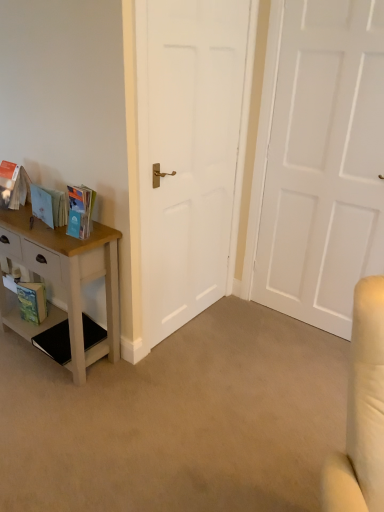
The height and width of the screenshot is (512, 384). What do you see at coordinates (322, 161) in the screenshot? I see `white matte door at center, the first door positioned from the right` at bounding box center [322, 161].

Locate an element on the screen. This screenshot has height=512, width=384. matte blue book at left, placed as the third book when sorted from left to right is located at coordinates (80, 211).

What is the approximate height of wooden table at left?

The height of wooden table at left is 2.48 inches.

Describe the element at coordinates (49, 206) in the screenshot. I see `matte cardboard book at left, the second book positioned from the right` at that location.

Where is `matte orange book at left, the third book viewed from the right`? matte orange book at left, the third book viewed from the right is located at coordinates (15, 189).

Is matte blue book at left, placed as the third book when sorted from left to right, next to green matte paperback book at lower left?

No, matte blue book at left, placed as the third book when sorted from left to right, is not making contact with green matte paperback book at lower left.

Is point (83, 195) closer or farther from the camera than point (30, 298)?

Point (83, 195).

From a real-world perspective, between matte blue book at left, positioned as the 1th book in right-to-left order, and green matte paperback book at lower left, who is vertically lower?

green matte paperback book at lower left is physically lower.

Is matte cardboard book at left, the second book positioned from the right, inside or outside of white matte door at center, the first door positioned from the right?

matte cardboard book at left, the second book positioned from the right, is located beyond the bounds of white matte door at center, the first door positioned from the right.

In terms of height, does matte cardboard book at left, the second book viewed from the left, look taller or shorter compared to white matte door at center, which appears as the 2th door when viewed from the left?

matte cardboard book at left, the second book viewed from the left, is shorter than white matte door at center, which appears as the 2th door when viewed from the left.

Does point (48, 216) lie behind point (378, 113)?

That is False.

From the white matte door at center, the first door positioned from the right, count the 2nd book to the left and point to it. Please provide its 2D coordinates.

[(49, 206)]

Which is in front, point (24, 180) or point (78, 196)?

Point (78, 196)

Is matte orange book at left, positioned as the first book in left-to-right order, aimed at matte blue book at left, placed as the third book when sorted from left to right?

No, matte orange book at left, positioned as the first book in left-to-right order, is not facing towards matte blue book at left, placed as the third book when sorted from left to right.

Considering the relative positions of matte orange book at left, the third book viewed from the right, and matte blue book at left, positioned as the 1th book in right-to-left order, in the image provided, is matte orange book at left, the third book viewed from the right, in front of matte blue book at left, positioned as the 1th book in right-to-left order,?

No, it is not.

From the picture: Between matte orange book at left, positioned as the first book in left-to-right order, and matte blue book at left, positioned as the 1th book in right-to-left order, which one has smaller size?

Smaller between the two is matte blue book at left, positioned as the 1th book in right-to-left order.

The height and width of the screenshot is (512, 384). Find the location of `plain on the right of matte cardboard book at left, the second book positioned from the right`. plain on the right of matte cardboard book at left, the second book positioned from the right is located at coordinates (178, 419).

Considering the relative positions of wooden table at left and matte cardboard book at left, the second book viewed from the left, in the image provided, is wooden table at left to the left or to the right of matte cardboard book at left, the second book viewed from the left,?

From the image, it's evident that wooden table at left is to the right of matte cardboard book at left, the second book viewed from the left.

From the picture: Who is more distant, wooden table at left or matte cardboard book at left, the second book positioned from the right?

matte cardboard book at left, the second book positioned from the right, is further away from the camera.

Consider the image. From a real-world perspective, is wooden table at left positioned above or below matte cardboard book at left, the second book viewed from the left?

wooden table at left is situated lower than matte cardboard book at left, the second book viewed from the left, in the real world.

Is white painted wood nightstand at left closer to the viewer compared to white matte door at center, the first door positioned from the right?

No, the depth of white painted wood nightstand at left is greater than that of white matte door at center, the first door positioned from the right.

Is white painted wood nightstand at left to the left or to the right of white matte door at center, the first door positioned from the right, in the image?

white painted wood nightstand at left is to the left of white matte door at center, the first door positioned from the right.

From the image's perspective, count 1st doors upward from the white painted wood nightstand at left and point to it. Please provide its 2D coordinates.

[(322, 161)]

From a real-world perspective, is white painted wood nightstand at left physically located above or below white matte door at center, which appears as the 2th door when viewed from the left?

In terms of real-world spatial position, white painted wood nightstand at left is below white matte door at center, which appears as the 2th door when viewed from the left.

Is white matte door at center, which appears as the 2th door when viewed from the left, not near matte orange book at left, positioned as the first book in left-to-right order?

white matte door at center, which appears as the 2th door when viewed from the left, is positioned a significant distance from matte orange book at left, positioned as the first book in left-to-right order.

Which book is the 3rd one when counting from the left side of the white matte door at center, which appears as the 2th door when viewed from the left? Please provide its 2D coordinates.

[(15, 189)]

From the image's perspective, relative to matte orange book at left, the third book viewed from the right, is white matte door at center, which appears as the 2th door when viewed from the left, above or below?

white matte door at center, which appears as the 2th door when viewed from the left, is above matte orange book at left, the third book viewed from the right.

Looking at this image, between white matte door at center, which appears as the 2th door when viewed from the left, and matte orange book at left, positioned as the first book in left-to-right order, which one has smaller width?

white matte door at center, which appears as the 2th door when viewed from the left.

Is matte cardboard book at left, the second book viewed from the left, looking in the opposite direction of white matte door at center, which is counted as the 1th door, starting from the left?

Yes, matte cardboard book at left, the second book viewed from the left, is facing away from white matte door at center, which is counted as the 1th door, starting from the left.

Is white matte door at center, which is counted as the 1th door, starting from the left, completely or partially inside matte cardboard book at left, the second book viewed from the left?

No, matte cardboard book at left, the second book viewed from the left, does not contain white matte door at center, which is counted as the 1th door, starting from the left.

Would you say matte cardboard book at left, the second book viewed from the left, is to the left or to the right of white matte door at center, which appears as the second door when viewed from the right, in the picture?

In the image, matte cardboard book at left, the second book viewed from the left, appears on the left side of white matte door at center, which appears as the second door when viewed from the right.

From the image's perspective, between matte cardboard book at left, the second book viewed from the left, and white matte door at center, which appears as the second door when viewed from the right, who is located below?

From the image's view, matte cardboard book at left, the second book viewed from the left, is below.

Where is `paperback book below the matte blue book at left, placed as the third book when sorted from left to right (from the image's perspective)`? The height and width of the screenshot is (512, 384). paperback book below the matte blue book at left, placed as the third book when sorted from left to right (from the image's perspective) is located at coordinates [x=32, y=301].

The height and width of the screenshot is (512, 384). What are the coordinates of `the 1st door in front of the matte cardboard book at left, the second book viewed from the left` in the screenshot? It's located at (322, 161).

Looking at the image, which one is located closer to matte cardboard book at left, the second book positioned from the right, green matte paperback book at lower left or white matte door at center, which appears as the 2th door when viewed from the left?

green matte paperback book at lower left lies closer to matte cardboard book at left, the second book positioned from the right, than the other object.

Considering their positions, is white painted wood nightstand at left positioned further to wooden table at left than matte blue book at left, positioned as the 1th book in right-to-left order?

Based on the image, matte blue book at left, positioned as the 1th book in right-to-left order, appears to be further to wooden table at left.

From the image, which object appears to be nearer to white matte door at center, which appears as the second door when viewed from the right, green matte paperback book at lower left or matte blue book at left, positioned as the 1th book in right-to-left order?

matte blue book at left, positioned as the 1th book in right-to-left order, lies closer to white matte door at center, which appears as the second door when viewed from the right, than the other object.

Based on their spatial positions, is wooden table at left or white matte door at center, which is counted as the 1th door, starting from the left, further from matte cardboard book at left, the second book positioned from the right?

wooden table at left lies further to matte cardboard book at left, the second book positioned from the right, than the other object.

When comparing their distances from green matte paperback book at lower left, does white painted wood nightstand at left or white matte door at center, which appears as the 2th door when viewed from the left, seem closer?

white painted wood nightstand at left.

Estimate the real-world distances between objects in this image. Which object is closer to white matte door at center, which appears as the 2th door when viewed from the left, white matte door at center, which is counted as the 1th door, starting from the left, or white painted wood nightstand at left?

white matte door at center, which is counted as the 1th door, starting from the left, is positioned closer to the anchor white matte door at center, which appears as the 2th door when viewed from the left.

Considering their positions, is white matte door at center, which is counted as the 1th door, starting from the left, positioned further to matte orange book at left, positioned as the first book in left-to-right order, than white painted wood nightstand at left?

Among the two, white matte door at center, which is counted as the 1th door, starting from the left, is located further to matte orange book at left, positioned as the first book in left-to-right order.

Looking at the image, which one is located further to wooden table at left, white painted wood nightstand at left or white matte door at center, which appears as the 2th door when viewed from the left?

white matte door at center, which appears as the 2th door when viewed from the left, is further to wooden table at left.

You are a GUI agent. You are given a task and a screenshot of the screen. Output one action in this format:
    pyautogui.click(x=<x>, y=<y>)
    Task: Click on the door located between matte blue book at left, positioned as the 1th book in right-to-left order, and white matte door at center, the first door positioned from the right, in the left-right direction
    
    Given the screenshot: What is the action you would take?
    pyautogui.click(x=189, y=152)

Find the location of a particular element. The width and height of the screenshot is (384, 512). book between wooden table at left and matte cardboard book at left, the second book viewed from the left, from front to back is located at coordinates (80, 211).

Find the location of a particular element. Image resolution: width=384 pixels, height=512 pixels. book situated between matte cardboard book at left, the second book viewed from the left, and white matte door at center, which appears as the second door when viewed from the right, from left to right is located at coordinates (80, 211).

Identify the location of nightstand positioned between wooden table at left and matte orange book at left, the third book viewed from the right, from near to far. The height and width of the screenshot is (512, 384). (64, 280).